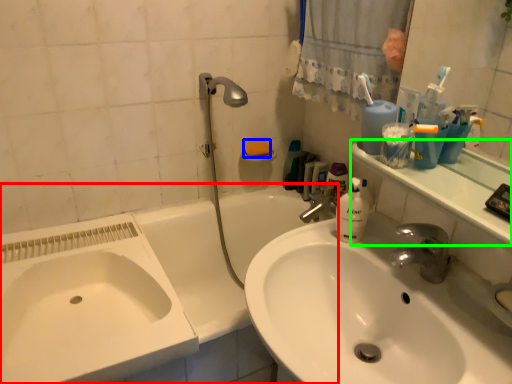
Question: Which object is the closest to the bathtub (highlighted by a red box)? Choose among these: soap (highlighted by a blue box) or counter top (highlighted by a green box).

Choices:
 (A) soap
 (B) counter top

Answer: (A)